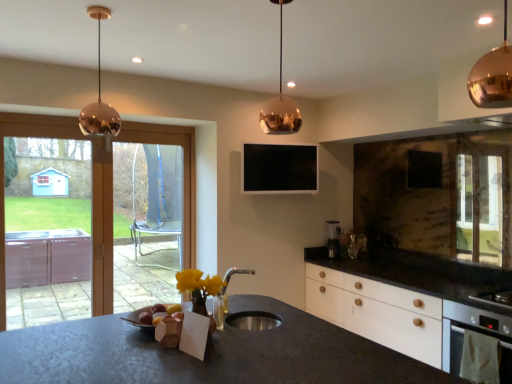
Question: Is black glossy tv at upper center further to the viewer compared to clear glass screen door at left, acting as the 1th screen door starting from the back?

Choices:
 (A) no
 (B) yes

Answer: (B)

Question: From the image's perspective, is black glossy tv at upper center located above clear glass screen door at left, which is the 2th screen door in front-to-back order?

Choices:
 (A) no
 (B) yes

Answer: (B)

Question: Does black glossy tv at upper center turn towards clear glass screen door at left, acting as the 1th screen door starting from the back?

Choices:
 (A) yes
 (B) no

Answer: (B)

Question: From a real-world perspective, is black glossy tv at upper center beneath clear glass screen door at left, acting as the 1th screen door starting from the back?

Choices:
 (A) no
 (B) yes

Answer: (A)

Question: Can you confirm if black glossy tv at upper center is bigger than clear glass screen door at left, acting as the 1th screen door starting from the right?

Choices:
 (A) no
 (B) yes

Answer: (A)

Question: From a real-world perspective, is black glossy tv at upper center positioned over clear glass screen door at left, acting as the 1th screen door starting from the right, based on gravity?

Choices:
 (A) no
 (B) yes

Answer: (B)

Question: Is copper/metallic pendant light at upper right, the third lamp in the left-to-right sequence, positioned before white matte oven at lower right?

Choices:
 (A) no
 (B) yes

Answer: (B)

Question: Is copper/metallic pendant light at upper right, which is the first lamp from right to left, bigger than white matte oven at lower right?

Choices:
 (A) yes
 (B) no

Answer: (A)

Question: Is copper/metallic pendant light at upper right, the first lamp viewed from the front, thinner than white matte oven at lower right?

Choices:
 (A) no
 (B) yes

Answer: (A)

Question: Can you confirm if copper/metallic pendant light at upper right, the third lamp in the left-to-right sequence, is taller than white matte oven at lower right?

Choices:
 (A) yes
 (B) no

Answer: (B)

Question: Does copper/metallic pendant light at upper right, which is the first lamp from right to left, have a lesser height compared to white matte oven at lower right?

Choices:
 (A) no
 (B) yes

Answer: (B)

Question: Are copper/metallic pendant light at upper right, positioned as the 3th lamp in back-to-front order, and white matte oven at lower right located far from each other?

Choices:
 (A) yes
 (B) no

Answer: (A)

Question: Can you confirm if copper metallic pendant light at upper center, the 2th lamp when ordered from left to right, is shorter than satin silver coffee machine at right?

Choices:
 (A) no
 (B) yes

Answer: (A)